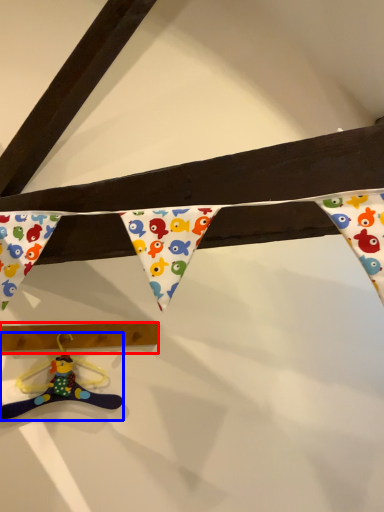
Question: Which point is closer to the camera, plank (highlighted by a red box) or toy (highlighted by a blue box)?

Choices:
 (A) plank
 (B) toy

Answer: (B)